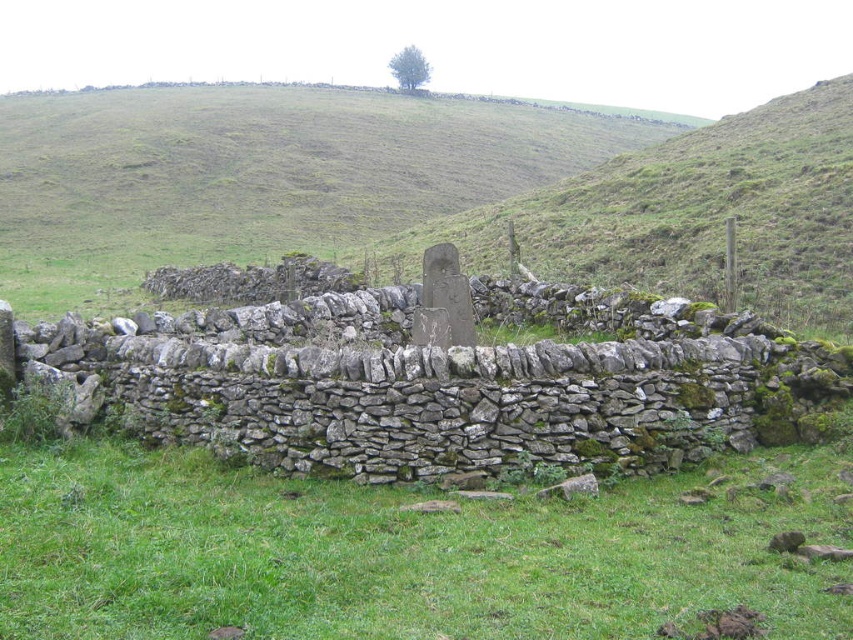
You are standing on the green grassy hillside at center and want to walk to the green grassy at center. Which direction should you head towards?

The green grassy hillside at center is positioned on the left side of green grassy at center, so you should head towards the right to reach the green grassy at center.

You are standing at the origin point in the image. The green grassy hillside at center is located at point 0.295, 0.525. Can you determine its direction from your current position?

The green grassy hillside at center is located at coordinates [447,188]. Since the origin is at [0,0], the hillside is northeast of your current position.

You are standing on the green grassy at center and want to reach the green grassy hillside at center. Which direction should you move to get there?

The green grassy hillside at center is above the green grassy at center, so you should move upward to reach it.